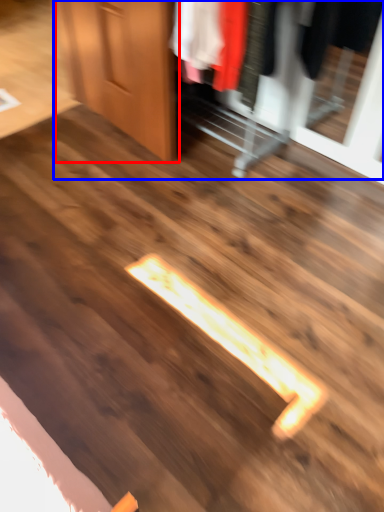
Question: Which object appears farthest to the camera in this image, door (highlighted by a red box) or dresser (highlighted by a blue box)?

Choices:
 (A) door
 (B) dresser

Answer: (A)